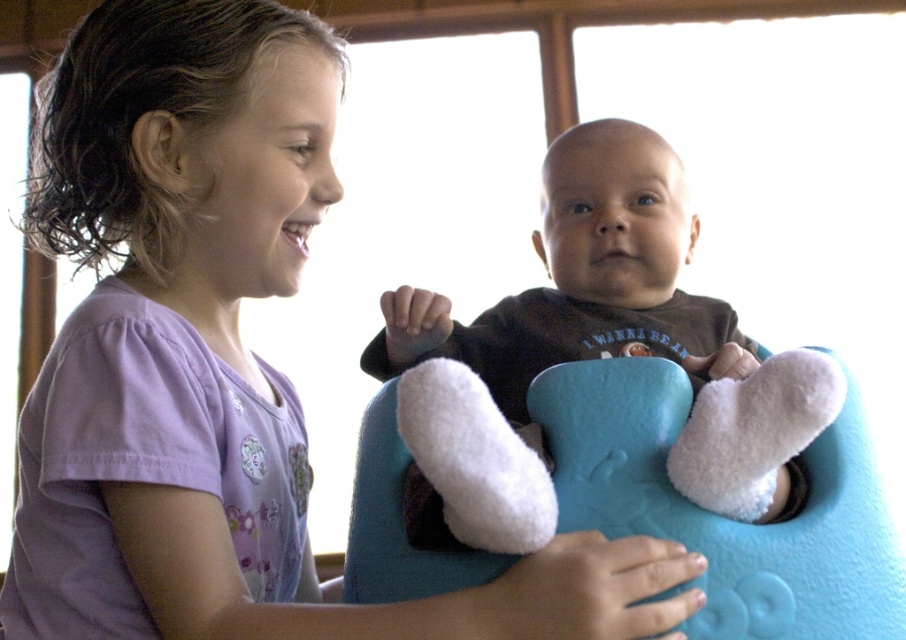
You are a photographer trying to capture the baby in the image. The soft brown baby at center is holding something. Where exactly is the fuzzy blue bib at center located in relation to the baby?

The fuzzy blue bib at center is located below the soft brown baby at center.

Looking at the image of the children, which object at the center is larger between the soft brown baby at center and the fuzzy blue bib at center?

The soft brown baby at center is bigger than the fuzzy blue bib at center.